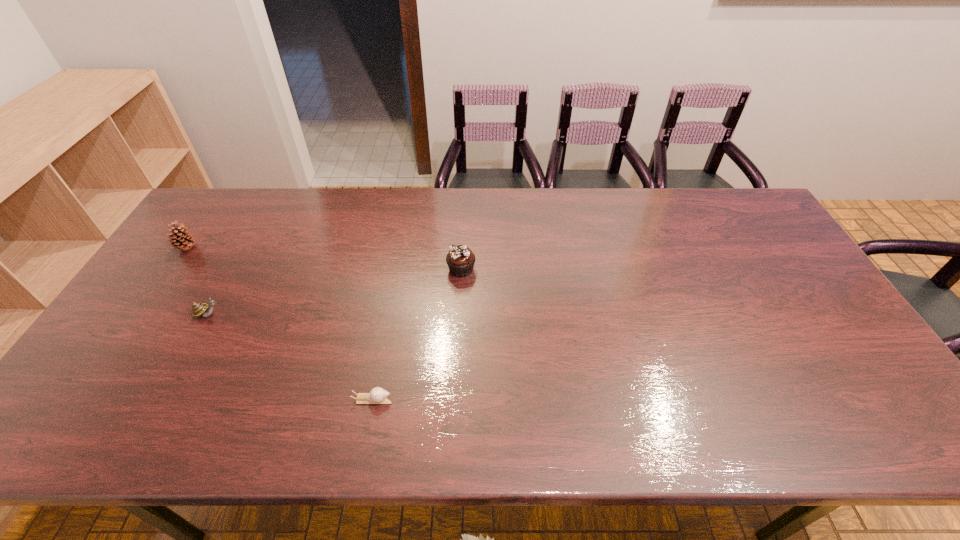
At what (x,y) coordinates should I click in order to perform the action: click on blank area located 0.160m on the face of the farther escargot. Please return your answer as a coordinate pair (x, y). Looking at the image, I should click on (282, 314).

The width and height of the screenshot is (960, 540). What are the coordinates of `vacant space located 0.180m on the shell of the nearest object` in the screenshot? It's located at (469, 400).

The width and height of the screenshot is (960, 540). Find the location of `object at the near edge`. object at the near edge is located at coordinates (377, 395).

The height and width of the screenshot is (540, 960). Find the location of `object that is at the left edge`. object that is at the left edge is located at coordinates (179, 234).

Find the location of a particular element. vacant space at the far edge of the desktop is located at coordinates coord(483,208).

Image resolution: width=960 pixels, height=540 pixels. In order to click on vacant space at the near edge of the desktop in this screenshot , I will do `click(378, 432)`.

The image size is (960, 540). Identify the location of blank space at the left edge of the desktop. (82, 378).

The height and width of the screenshot is (540, 960). Find the location of `vacant space at the right edge of the desktop`. vacant space at the right edge of the desktop is located at coordinates (859, 357).

In the image, there is a desktop. At what (x,y) coordinates should I click in order to perform the action: click on vacant area at the far left corner. Please return your answer as a coordinate pair (x, y). Image resolution: width=960 pixels, height=540 pixels. Looking at the image, I should click on (227, 223).

In order to click on vacant region at the near right corner of the desktop in this screenshot , I will do pyautogui.click(x=831, y=415).